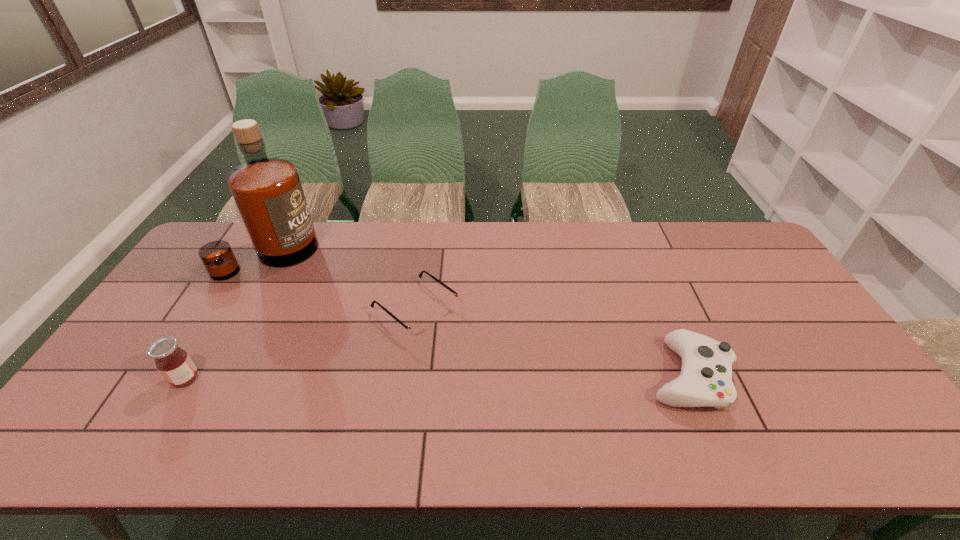
Locate an element on the screen. vacant region located on the front label of the liquor is located at coordinates (309, 298).

At what (x,y) coordinates should I click in order to perform the action: click on vacant space situated 0.100m on the front label of the liquor. Please return your answer as a coordinate pair (x, y). The image size is (960, 540). Looking at the image, I should click on (303, 291).

Locate an element on the screen. Image resolution: width=960 pixels, height=540 pixels. vacant space located on the front label of the liquor is located at coordinates (348, 343).

Locate an element on the screen. The height and width of the screenshot is (540, 960). vacant area situated 0.260m at the hinge ends of the shortest object is located at coordinates click(516, 387).

What are the coordinates of `blank space located at the hinge ends of the shortest object` in the screenshot? It's located at pyautogui.click(x=492, y=369).

Identify the location of free space located 0.150m at the hinge ends of the shortest object. (484, 362).

Where is `object that is at the far edge`? object that is at the far edge is located at coordinates (267, 192).

Find the location of `jam positioned at the near edge`. jam positioned at the near edge is located at coordinates (175, 365).

The image size is (960, 540). In order to click on control that is at the near edge in this screenshot , I will do `click(705, 380)`.

The height and width of the screenshot is (540, 960). Identify the location of object that is at the left edge. (267, 192).